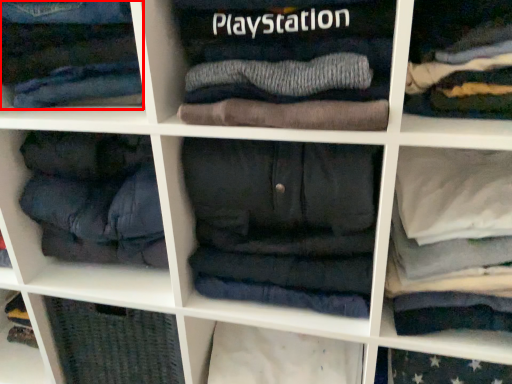
Question: Considering the relative positions of clothing (annotated by the red box) and clothing in the image provided, where is clothing (annotated by the red box) located with respect to the staircase?

Choices:
 (A) left
 (B) right

Answer: (A)